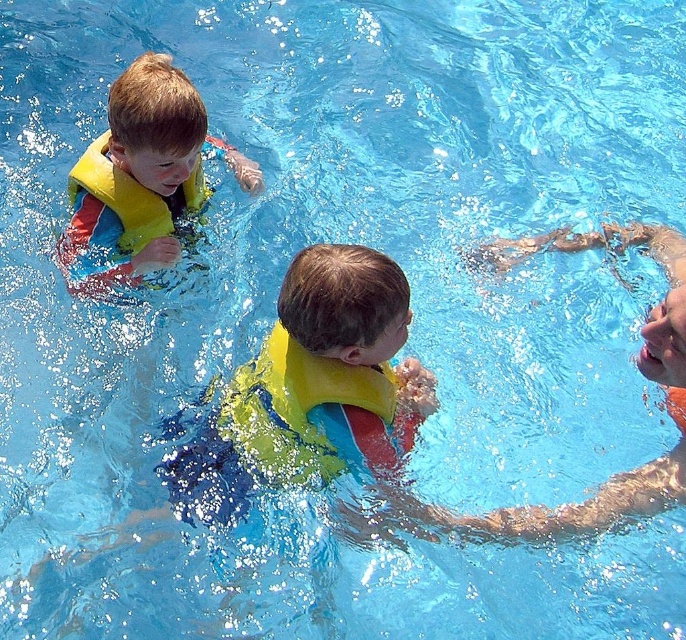
You are a lifeguard observing the pool area. You notice two life preservers in the water at the center of the pool. Which one is closer to you, the yellow life vest at center or the yellow foam life jacket at center?

The yellow life vest at center is closer to the viewer than the yellow foam life jacket at center.

You are a lifeguard at the pool and need to ensure all life vests fit properly. The yellow life vest at upper left and the yellow life vest at center are both in use. Which life vest is more suitable for a child with a larger frame?

The yellow life vest at upper left has a larger size compared to the yellow life vest at center, so it is more suitable for a child with a larger frame.